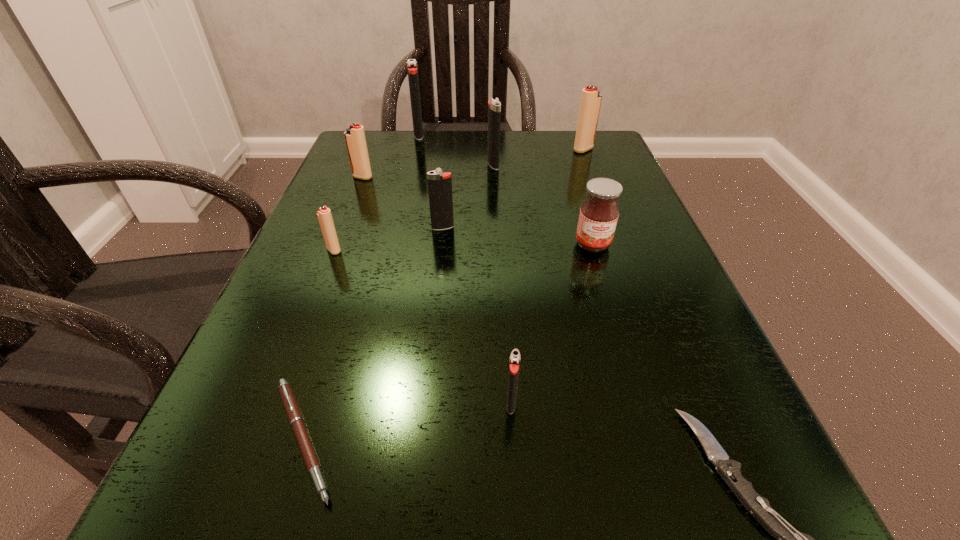
At what (x,y) coordinates should I click in order to perform the action: click on vacant space located 0.120m on the right of the second biggest red igniter. Please return your answer as a coordinate pair (x, y). Looking at the image, I should click on (428, 177).

I want to click on vacant space located 0.230m on the label side of the jam, so click(630, 365).

Find the location of a particular element. Image resolution: width=960 pixels, height=540 pixels. free space located 0.250m on the right of the nearest red igniter is located at coordinates pos(485,250).

Locate an element on the screen. The width and height of the screenshot is (960, 540). vacant space located on the back of the nearest black igniter is located at coordinates (508, 348).

This screenshot has height=540, width=960. What are the coordinates of `blank space located at the nib of the pink pen` in the screenshot? It's located at [x=615, y=439].

Where is `object located in the near edge section of the desktop`? object located in the near edge section of the desktop is located at coordinates (296, 420).

You are a GUI agent. You are given a task and a screenshot of the screen. Output one action in this format:
    pyautogui.click(x=<x>, y=<y>)
    Task: Click on the pen at the left edge
    
    Given the screenshot: What is the action you would take?
    pyautogui.click(x=296, y=420)

The width and height of the screenshot is (960, 540). Identify the location of igniter that is positioned at the right edge. (590, 104).

Identify the location of jam present at the right edge. The width and height of the screenshot is (960, 540). (599, 213).

Where is `object present at the near left corner`? The width and height of the screenshot is (960, 540). object present at the near left corner is located at coordinates (296, 420).